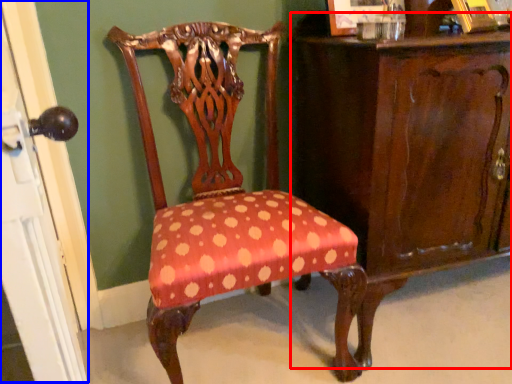
Question: Which of the following is the closest to the observer, vanity (highlighted by a red box) or screen door (highlighted by a blue box)?

Choices:
 (A) vanity
 (B) screen door

Answer: (B)